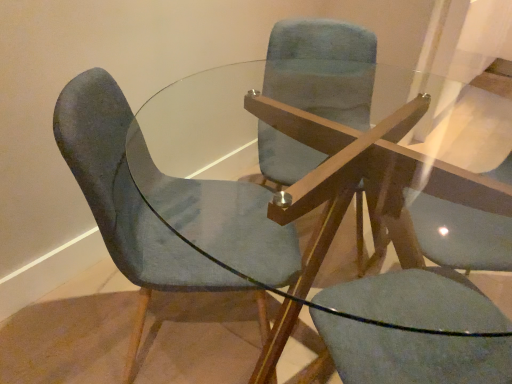
What are the coordinates of `velvet blue chair at left, arranged as the second chair when viewed from the left` in the screenshot? It's located at (159, 201).

Identify the location of matte blue swivel chair at center. (411, 355).

Who is shorter, matte blue swivel chair at center or velvet blue chair at left, arranged as the second chair when viewed from the left?

velvet blue chair at left, arranged as the second chair when viewed from the left, is shorter.

Is matte blue swivel chair at center oriented away from velvet blue chair at left, arranged as the second chair when viewed from the left?

That's right, matte blue swivel chair at center is facing away from velvet blue chair at left, arranged as the second chair when viewed from the left.

Image resolution: width=512 pixels, height=384 pixels. I want to click on the 1st chair above the matte blue swivel chair at center (from the image's perspective), so click(x=159, y=201).

Can you confirm if velvet blue chair at center, acting as the 2th chair starting from the right, is thinner than matte blue swivel chair at center?

No, velvet blue chair at center, acting as the 2th chair starting from the right, is not thinner than matte blue swivel chair at center.

From the image's perspective, count 2nd chairs upward from the matte blue swivel chair at center and point to it. Please provide its 2D coordinates.

[(323, 69)]

Is velvet blue chair at center, arranged as the 1th chair when viewed from the left, bigger than matte blue swivel chair at center?

Actually, velvet blue chair at center, arranged as the 1th chair when viewed from the left, might be smaller than matte blue swivel chair at center.

Is velvet blue chair at center, acting as the 2th chair starting from the right, shorter than matte blue swivel chair at center?

Yes, velvet blue chair at center, acting as the 2th chair starting from the right, is shorter than matte blue swivel chair at center.

From the image's perspective, between velvet blue chair at left, the first chair viewed from the right, and velvet blue chair at center, arranged as the 1th chair when viewed from the left, who is located below?

velvet blue chair at left, the first chair viewed from the right.

Is velvet blue chair at left, the first chair viewed from the right, looking in the opposite direction of velvet blue chair at center, arranged as the 1th chair when viewed from the left?

Absolutely, velvet blue chair at left, the first chair viewed from the right, is directed away from velvet blue chair at center, arranged as the 1th chair when viewed from the left.

From the picture: Which object is positioned more to the right, velvet blue chair at left, the first chair viewed from the right, or velvet blue chair at center, arranged as the 1th chair when viewed from the left?

Positioned to the right is velvet blue chair at left, the first chair viewed from the right.

From a real-world perspective, which object rests below the other?

From a 3D spatial view, velvet blue chair at left, the first chair viewed from the right, is below.

Between velvet blue chair at left, the first chair viewed from the right, and matte blue swivel chair at center, which one is positioned in front?

matte blue swivel chair at center.

From the image's perspective, which is above, velvet blue chair at left, the first chair viewed from the right, or matte blue swivel chair at center?

velvet blue chair at left, the first chair viewed from the right, appears higher in the image.

Does velvet blue chair at left, the first chair viewed from the right, have a greater height compared to matte blue swivel chair at center?

No.

From the picture: Would you say matte blue swivel chair at center is inside or outside velvet blue chair at center, arranged as the 1th chair when viewed from the left?

matte blue swivel chair at center exists outside the volume of velvet blue chair at center, arranged as the 1th chair when viewed from the left.

Does matte blue swivel chair at center come behind velvet blue chair at center, arranged as the 1th chair when viewed from the left?

No, it is in front of velvet blue chair at center, arranged as the 1th chair when viewed from the left.

Is matte blue swivel chair at center far from velvet blue chair at center, acting as the 2th chair starting from the right?

Actually, matte blue swivel chair at center and velvet blue chair at center, acting as the 2th chair starting from the right, are a little close together.

At what (x,y) coordinates should I click in order to perform the action: click on swivel chair located in front of the velvet blue chair at center, arranged as the 1th chair when viewed from the left. Please return your answer as a coordinate pair (x, y). This screenshot has height=384, width=512. Looking at the image, I should click on (411, 355).

Is the surface of velvet blue chair at center, arranged as the 1th chair when viewed from the left, in direct contact with velvet blue chair at left, the first chair viewed from the right?

They are not placed beside each other.

Can velvet blue chair at left, arranged as the second chair when viewed from the left, be found inside velvet blue chair at center, acting as the 2th chair starting from the right?

No, velvet blue chair at center, acting as the 2th chair starting from the right, does not contain velvet blue chair at left, arranged as the second chair when viewed from the left.

Which object is positioned more to the left, velvet blue chair at center, arranged as the 1th chair when viewed from the left, or velvet blue chair at left, arranged as the second chair when viewed from the left?

Positioned to the left is velvet blue chair at center, arranged as the 1th chair when viewed from the left.

From a real-world perspective, is velvet blue chair at center, arranged as the 1th chair when viewed from the left, positioned above or below velvet blue chair at left, arranged as the second chair when viewed from the left?

velvet blue chair at center, arranged as the 1th chair when viewed from the left, is above velvet blue chair at left, arranged as the second chair when viewed from the left.

Where is `the 1st chair behind when counting from the matte blue swivel chair at center`? The image size is (512, 384). the 1st chair behind when counting from the matte blue swivel chair at center is located at coordinates [x=159, y=201].

Identify the location of chair above the matte blue swivel chair at center (from a real-world perspective). (323, 69).

Based on the photo, when comparing their distances from velvet blue chair at center, arranged as the 1th chair when viewed from the left, does matte blue swivel chair at center or velvet blue chair at left, arranged as the second chair when viewed from the left, seem closer?

Among the two, velvet blue chair at left, arranged as the second chair when viewed from the left, is located nearer to velvet blue chair at center, arranged as the 1th chair when viewed from the left.

Based on their spatial positions, is velvet blue chair at left, the first chair viewed from the right, or matte blue swivel chair at center further from velvet blue chair at center, arranged as the 1th chair when viewed from the left?

matte blue swivel chair at center is positioned further to the anchor velvet blue chair at center, arranged as the 1th chair when viewed from the left.

Estimate the real-world distances between objects in this image. Which object is closer to velvet blue chair at left, arranged as the second chair when viewed from the left, velvet blue chair at center, arranged as the 1th chair when viewed from the left, or matte blue swivel chair at center?

matte blue swivel chair at center is positioned closer to the anchor velvet blue chair at left, arranged as the second chair when viewed from the left.

Which object lies nearer to the anchor point matte blue swivel chair at center, velvet blue chair at left, the first chair viewed from the right, or velvet blue chair at center, arranged as the 1th chair when viewed from the left?

velvet blue chair at left, the first chair viewed from the right.

Based on their spatial positions, is matte blue swivel chair at center or velvet blue chair at center, arranged as the 1th chair when viewed from the left, closer to velvet blue chair at left, the first chair viewed from the right?

matte blue swivel chair at center lies closer to velvet blue chair at left, the first chair viewed from the right, than the other object.

From the image, which object appears to be farther from matte blue swivel chair at center, velvet blue chair at center, acting as the 2th chair starting from the right, or velvet blue chair at left, arranged as the second chair when viewed from the left?

velvet blue chair at center, acting as the 2th chair starting from the right.

This screenshot has width=512, height=384. What are the coordinates of `chair between matte blue swivel chair at center and velvet blue chair at center, acting as the 2th chair starting from the right, along the z-axis` in the screenshot? It's located at (159, 201).